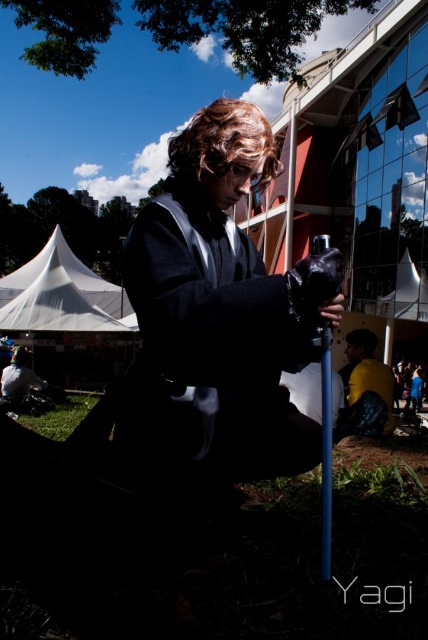
Who is shorter, matte black kimono at center or yellow matte jacket at lower right?

yellow matte jacket at lower right is shorter.

Does matte black kimono at center have a smaller size compared to yellow matte jacket at lower right?

No, matte black kimono at center is not smaller than yellow matte jacket at lower right.

Which is in front, point (243, 323) or point (359, 384)?

Point (243, 323) is more forward.

Find the location of a particular element. This screenshot has height=640, width=428. matte black kimono at center is located at coordinates (222, 300).